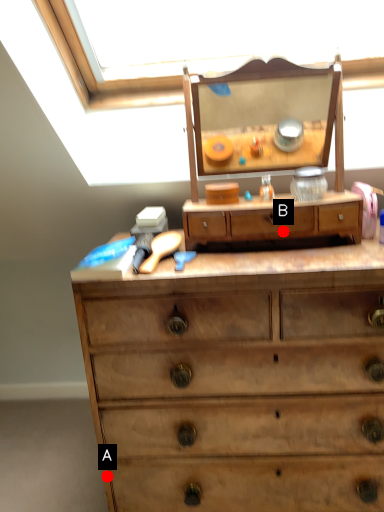
Question: Two points are circled on the image, labeled by A and B beside each circle. Among these points, which one is nearest to the camera?

Choices:
 (A) A is closer
 (B) B is closer

Answer: (B)